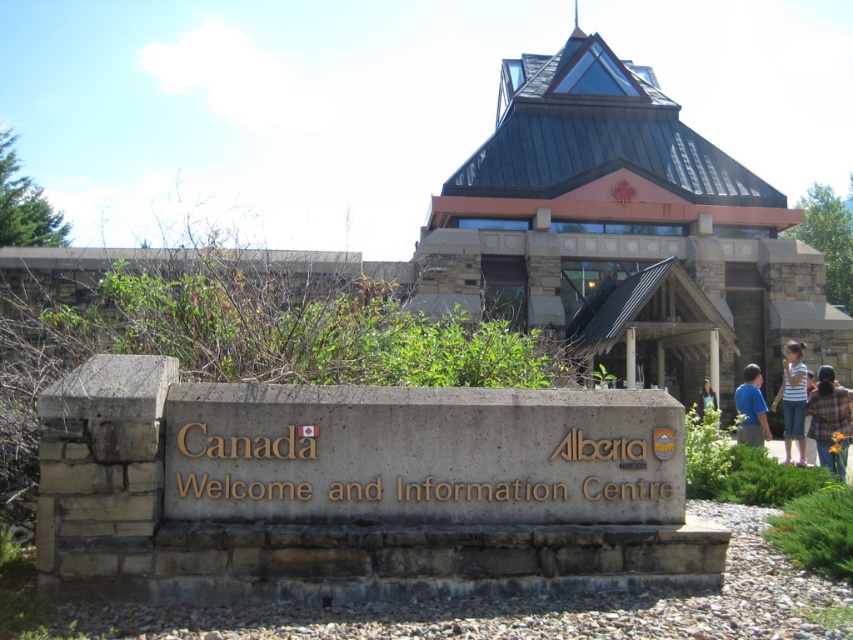
Does brown concrete sign at center have a smaller size compared to plaid shirt at center?

No.

Which of these two, brown concrete sign at center or plaid shirt at center, stands shorter?

With less height is plaid shirt at center.

Identify the location of brown concrete sign at center. This screenshot has width=853, height=640. (422, 454).

Between point (784, 388) and point (708, 394), which one is positioned in front?

Point (784, 388)

Can you confirm if striped fabric shirt at center is taller than blurred fabric person at center?

Correct, striped fabric shirt at center is much taller as blurred fabric person at center.

Which is behind, point (773, 404) or point (706, 392)?

The point (706, 392) is behind.

Locate an element on the screen. striped fabric shirt at center is located at coordinates [x=792, y=400].

Does plaid shirt at center appear over blue shirt at right?

Actually, plaid shirt at center is below blue shirt at right.

Which of these two, plaid shirt at center or blue shirt at right, stands taller?

blue shirt at right is taller.

At what (x,y) coordinates should I click in order to perform the action: click on plaid shirt at center. Please return your answer as a coordinate pair (x, y). This screenshot has height=640, width=853. Looking at the image, I should click on (830, 419).